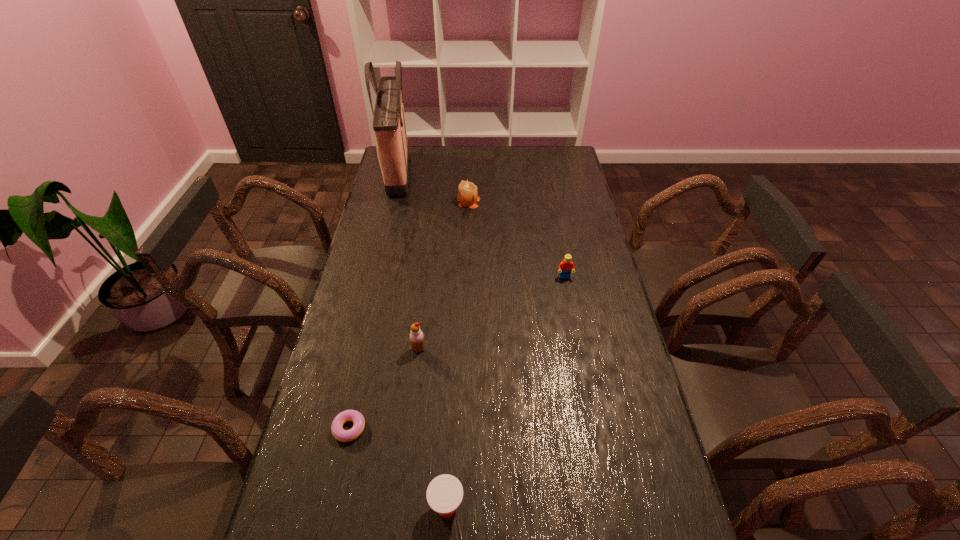
This screenshot has width=960, height=540. Find the location of `vacant space situated 0.260m on the right of the tallest object`. vacant space situated 0.260m on the right of the tallest object is located at coordinates (470, 174).

At what (x,y) coordinates should I click in order to perform the action: click on free location located 0.310m at the front with a straw on the fourth object from right to left. Please return your answer as a coordinate pair (x, y). Looking at the image, I should click on (406, 456).

Identify the location of vacant space situated on the right of the candle. (492, 201).

At what (x,y) coordinates should I click in order to perform the action: click on vacant area located on the face of the fourth nearest object. Please return your answer as a coordinate pair (x, y). Looking at the image, I should click on (578, 348).

This screenshot has width=960, height=540. What are the coordinates of `vacant area located 0.350m on the right of the Dixie cup` in the screenshot? It's located at (612, 507).

Identify the location of free space located 0.310m on the right of the fifth farthest object. (482, 428).

Image resolution: width=960 pixels, height=540 pixels. I want to click on object that is at the far edge, so click(389, 127).

Find the location of a particular element. shopping bag present at the left edge is located at coordinates (389, 127).

I want to click on doughnut at the left edge, so click(338, 432).

This screenshot has width=960, height=540. In order to click on object located at the right edge in this screenshot , I will do `click(566, 266)`.